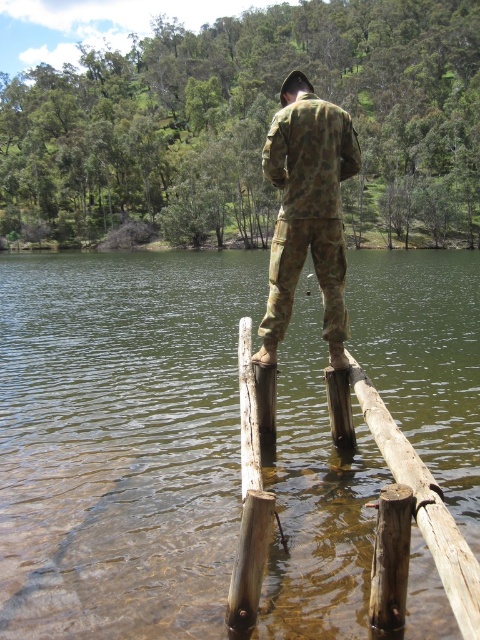
You are a park ranger inspecting a wooden platform on a lake. You notice two structures at the center of the platform. One is the brown wooden rail at center and the other is the brown wood pole at center. Which of these two is bigger in size?

The brown wooden rail at center is larger in size than the brown wood pole at center.